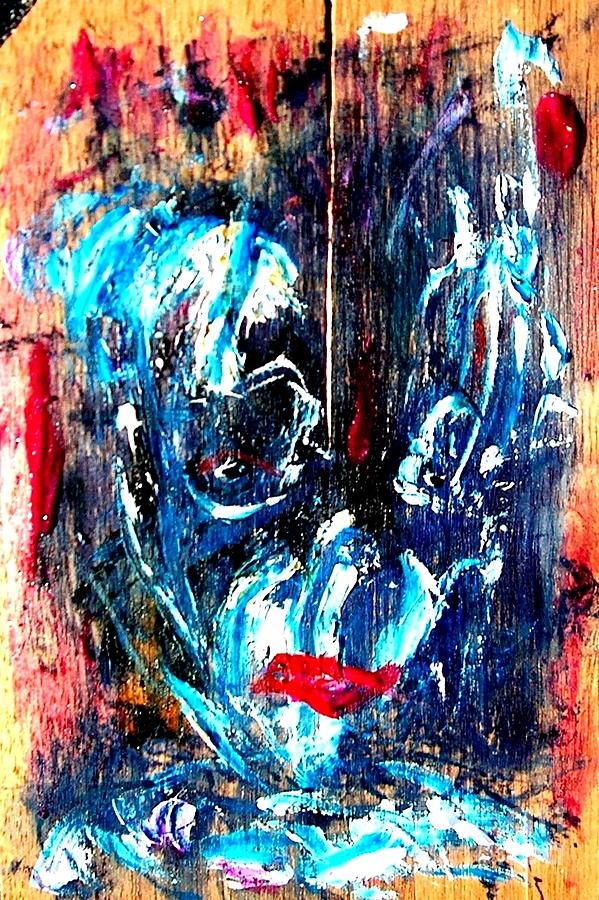
Locate an element on the screen. The height and width of the screenshot is (900, 599). art is located at coordinates (314, 475).